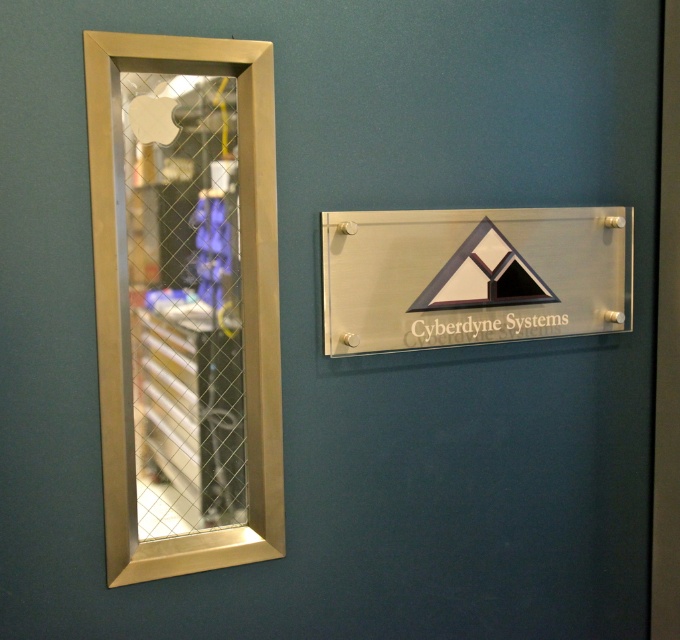
Question: Does brushed metal elevator at left appear on the left side of clear acrylic sign at center?

Choices:
 (A) yes
 (B) no

Answer: (A)

Question: Is brushed metal elevator at left smaller than clear acrylic sign at center?

Choices:
 (A) no
 (B) yes

Answer: (A)

Question: Does brushed metal elevator at left appear over clear acrylic sign at center?

Choices:
 (A) no
 (B) yes

Answer: (A)